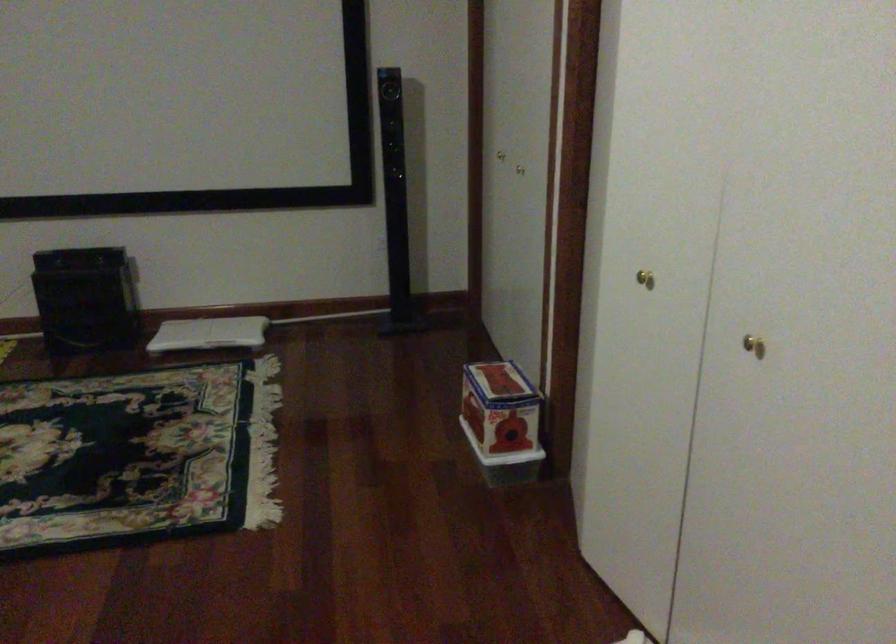
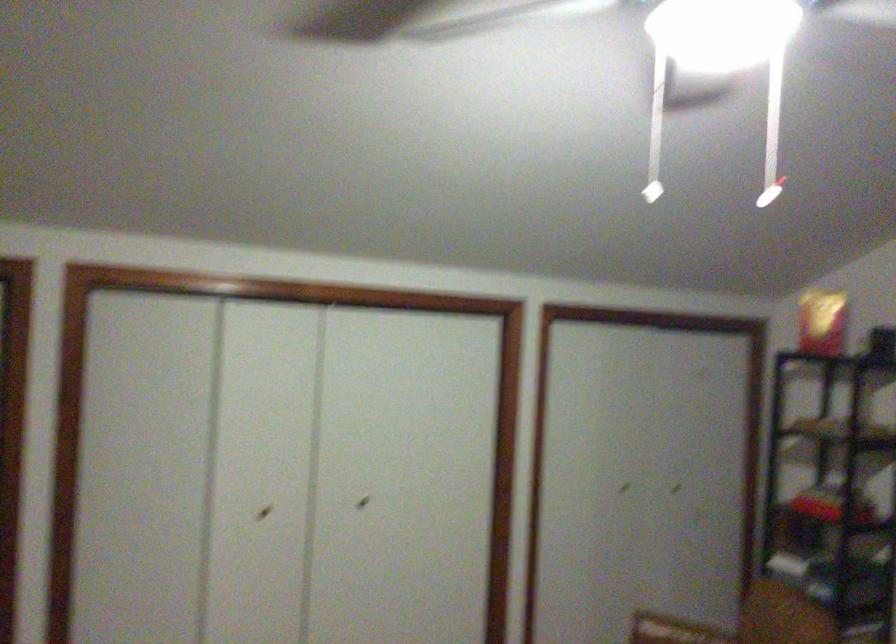
Where in the second image is the point corresponding to [790,365] from the first image?

(363, 502)